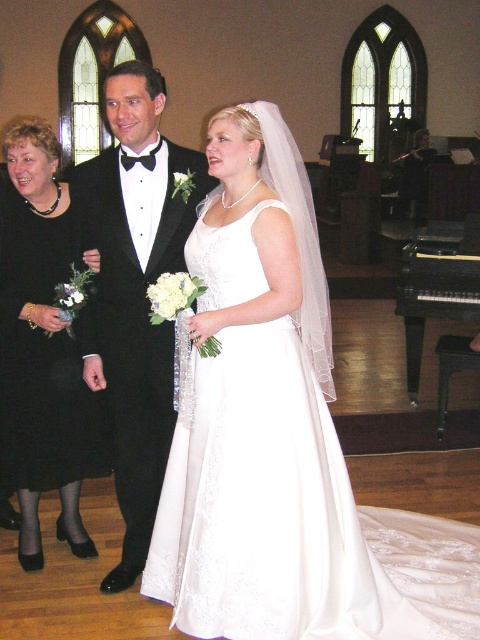
You are a photographer positioned at the entrance of the church. You need to capture a photo of the black satin tuxedo at center. According to the coordinates provided, where should you aim your camera to ensure the tuxedo is centered in the frame?

The black satin tuxedo at center is located at the 2D coordinates point (133,292), so aim your camera at that point to center it in the frame.

You are a photographer positioned at the entrance of the chapel. You want to capture a photo of the white satin dress at center. According to the coordinates provided, where should you aim your camera to ensure the dress is centered in the frame?

The white satin dress at center is located at coordinates point (291, 516), so aiming your camera at that point will center the dress in the frame.

You are a photographer setting up for a wedding photo shoot. You need to position the bride in her white satin dress at center so that she is the focal point while also ensuring the black polished wood piano at right is visible in the background. Given their sizes, how should you arrange the composition?

The white satin dress at center is bigger than the black polished wood piano at right, so to make the bride the focal point while still including the piano, position the bride centrally with enough space between her and the piano. This way, her larger presence draws attention, and the piano remains visible in the background without overpowering the composition.